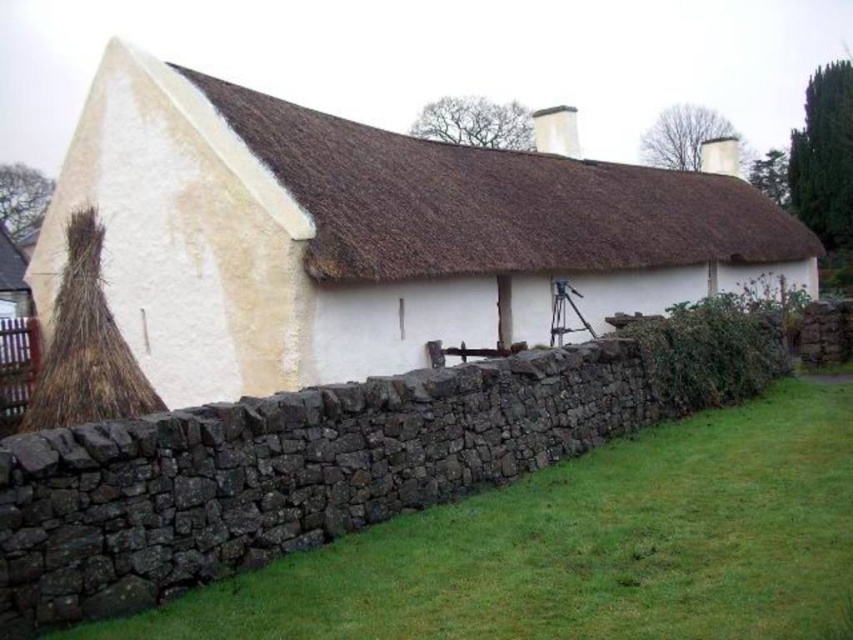
You are standing in front of the white stucco cottage at center and the brown thatch roof at center. Which one is positioned to the left?

The white stucco cottage at center is positioned to the left of the brown thatch roof at center.

You are a landscape architect designing a garden path that needs to be 10 meters long. You want to start the path at the white stucco cottage at center and end it at the green grass at lower right. Can the path fit within the required length?

The distance between the white stucco cottage at center and the green grass at lower right is 12.17 meters, which exceeds the 10 meters required for the garden path. Therefore, the path cannot fit within the required length.